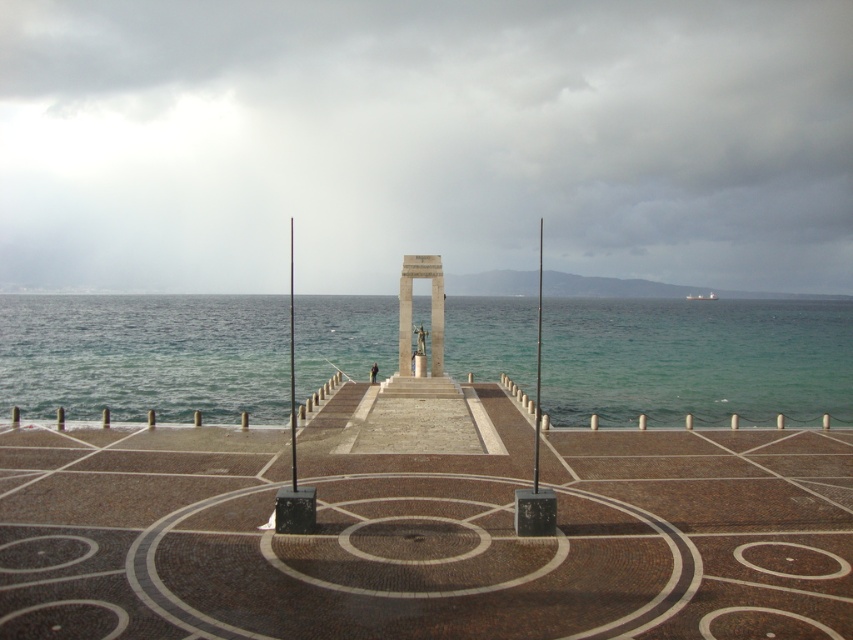
You are standing at the edge of the brown mosaic dock at center and want to take a photo of the monument behind you. Your camera has a maximum focus range of 10 meters. Will the monument be in focus?

The distance between the brown mosaic dock at center and the camera is 10.25 meters, which exceeds the camera maximum focus range of 10 meters. Therefore, the monument will not be in focus.

You are a visitor approaching the polished stone monument at center from the sea. As you walk along the brown mosaic dock at center, which side of the monument will the dock be on when you reach it?

The brown mosaic dock at center is to the left of the polished stone monument at center, so when you reach the monument, the dock will be on its left side.